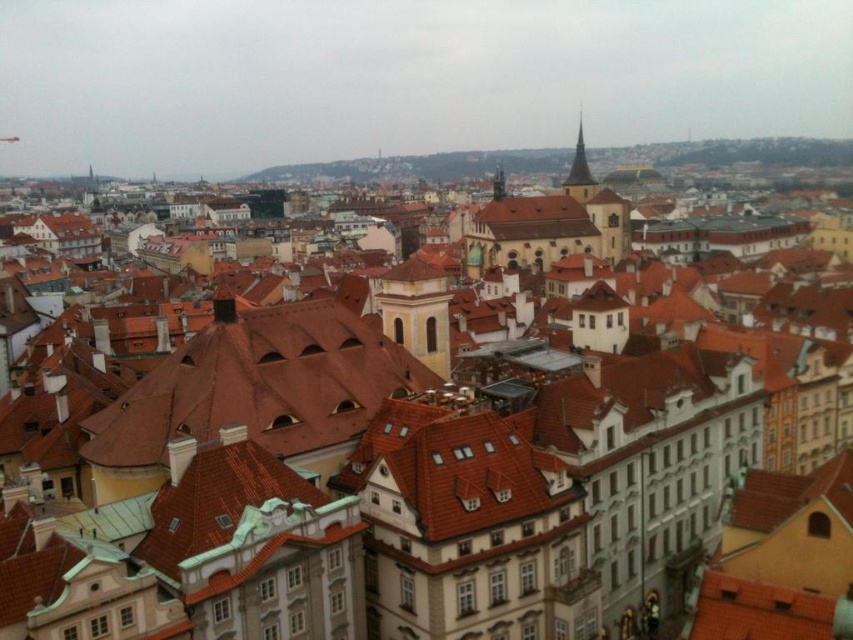
Does brown tile roof at center have a lesser width compared to smooth stone spire at upper right?

Yes, brown tile roof at center is thinner than smooth stone spire at upper right.

What do you see at coordinates (259, 388) in the screenshot?
I see `brown tile roof at center` at bounding box center [259, 388].

Image resolution: width=853 pixels, height=640 pixels. What are the coordinates of `brown tile roof at center` in the screenshot? It's located at (259, 388).

Does point (579, 195) come closer to viewer compared to point (492, 179)?

Yes, point (579, 195) is in front of point (492, 179).

Can you confirm if smooth stone spire at upper right is smaller than smooth stone tower at center?

No, smooth stone spire at upper right is not smaller than smooth stone tower at center.

Find the location of a particular element. smooth stone spire at upper right is located at coordinates (579, 172).

Does brown tile roof at center have a lesser height compared to smooth stone tower at center?

Correct, brown tile roof at center is not as tall as smooth stone tower at center.

Is point (425, 371) positioned before point (498, 173)?

That is True.

This screenshot has width=853, height=640. Identify the location of brown tile roof at center. (259, 388).